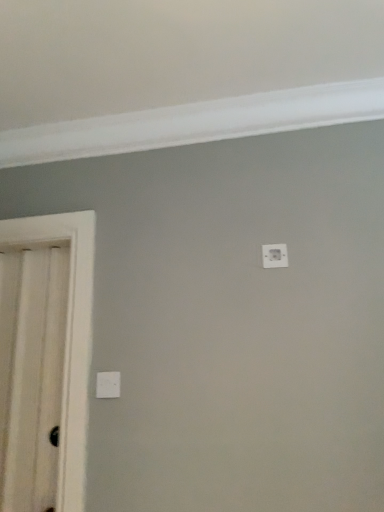
Question: Is white plastic light switch at upper center, arranged as the second light switch when ordered from the bottom, completely or partially inside white glossy door at left?

Choices:
 (A) yes
 (B) no

Answer: (B)

Question: Can you confirm if white glossy door at left is smaller than white plastic light switch at upper center, the 1th light switch positioned from the top?

Choices:
 (A) yes
 (B) no

Answer: (B)

Question: Is white glossy door at left far from white plastic light switch at upper center, the 1th light switch positioned from the top?

Choices:
 (A) no
 (B) yes

Answer: (A)

Question: Could you tell me if white glossy door at left is turned towards white plastic light switch at upper center, the 1th light switch positioned from the top?

Choices:
 (A) no
 (B) yes

Answer: (A)

Question: From a real-world perspective, is white glossy door at left below white plastic light switch at upper center, the 1th light switch positioned from the top?

Choices:
 (A) no
 (B) yes

Answer: (B)

Question: Is white plastic light switch at upper center, placed as the second light switch when sorted from left to right, to the left or to the right of white glossy door at left in the image?

Choices:
 (A) right
 (B) left

Answer: (A)

Question: In terms of size, does white plastic light switch at upper center, the 1th light switch positioned from the top, appear bigger or smaller than white glossy door at left?

Choices:
 (A) big
 (B) small

Answer: (B)

Question: Is white plastic light switch at upper center, which is counted as the 1th light switch, starting from the right, wider or thinner than white glossy door at left?

Choices:
 (A) thin
 (B) wide

Answer: (A)

Question: Is white plastic light switch at upper center, placed as the second light switch when sorted from left to right, taller or shorter than white glossy door at left?

Choices:
 (A) short
 (B) tall

Answer: (A)

Question: Considering the positions of point (9, 482) and point (276, 250), is point (9, 482) closer or farther from the camera than point (276, 250)?

Choices:
 (A) closer
 (B) farther

Answer: (B)

Question: In the image, is white glossy door at left positioned in front of or behind white plastic light switch at upper center, which is counted as the 1th light switch, starting from the right?

Choices:
 (A) behind
 (B) front

Answer: (B)

Question: Which is correct: white glossy door at left is inside white plastic light switch at upper center, the 1th light switch positioned from the top, or outside of it?

Choices:
 (A) inside
 (B) outside

Answer: (B)

Question: Considering the positions of white glossy door at left and white plastic light switch at upper center, placed as the second light switch when sorted from left to right, in the image, is white glossy door at left taller or shorter than white plastic light switch at upper center, placed as the second light switch when sorted from left to right,?

Choices:
 (A) short
 (B) tall

Answer: (B)

Question: Is white glossy door at left wider or thinner than white plastic light switch at lower center, marked as the 1th light switch in a bottom-to-top arrangement?

Choices:
 (A) wide
 (B) thin

Answer: (A)

Question: Is white glossy door at left taller or shorter than white plastic light switch at lower center, positioned as the second light switch in right-to-left order?

Choices:
 (A) tall
 (B) short

Answer: (A)